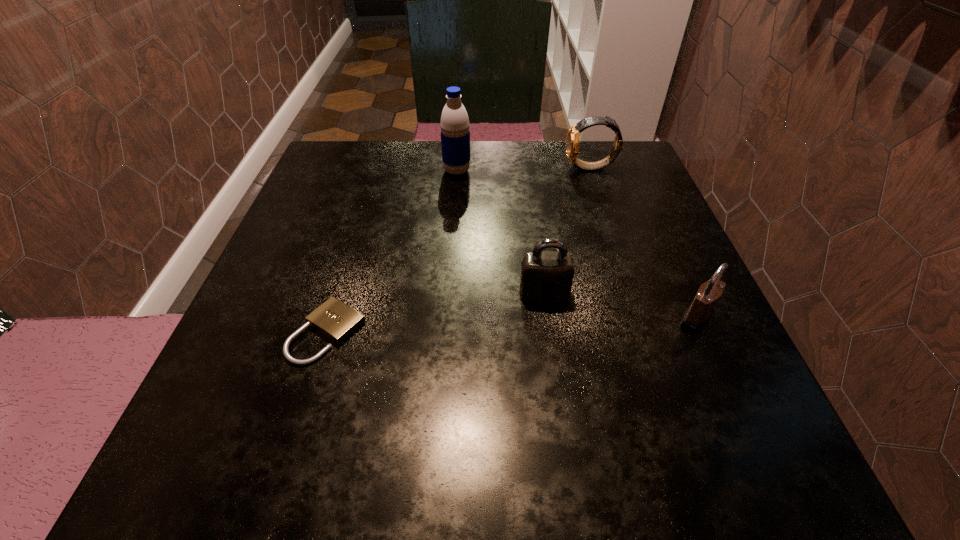
Where is `free space between the second padlock from left to right and the leftmost object`? free space between the second padlock from left to right and the leftmost object is located at coordinates (436, 313).

This screenshot has height=540, width=960. I want to click on free spot between the second padlock from left to right and the fourth object from right to left, so click(x=500, y=231).

The image size is (960, 540). Find the location of `vacant point located between the rightmost padlock and the shortest object`. vacant point located between the rightmost padlock and the shortest object is located at coordinates (513, 325).

The image size is (960, 540). In order to click on free spot between the second padlock from right to left and the shortest object in this screenshot , I will do pyautogui.click(x=436, y=313).

Where is `vacant point located between the watch and the water bottle`? The width and height of the screenshot is (960, 540). vacant point located between the watch and the water bottle is located at coordinates (524, 169).

Locate an element on the screen. vacant point located between the water bottle and the watch is located at coordinates (524, 169).

Find the location of a particular element. empty space between the watch and the second object from left to right is located at coordinates (524, 169).

Find the location of a particular element. This screenshot has height=540, width=960. vacant space that is in between the fourth object from right to left and the second padlock from left to right is located at coordinates (500, 231).

Find the location of `object that is the nearest to the second padlock from right to left`. object that is the nearest to the second padlock from right to left is located at coordinates (698, 314).

You are a GUI agent. You are given a task and a screenshot of the screen. Output one action in this format:
    pyautogui.click(x=<x>, y=<y>)
    Task: Click on the object that is the fourth closest to the watch
    Image resolution: width=960 pixels, height=540 pixels.
    Given the screenshot: What is the action you would take?
    pyautogui.click(x=334, y=319)